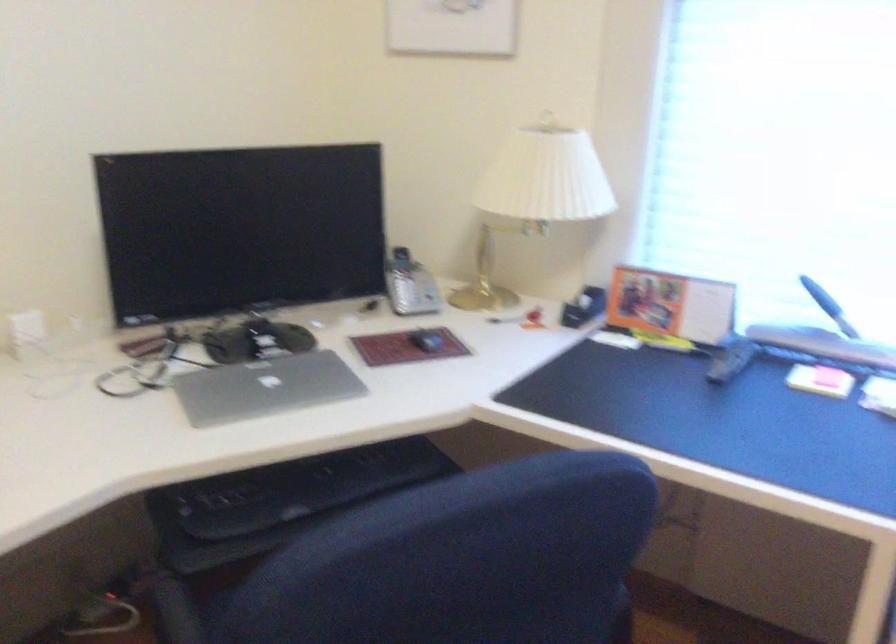
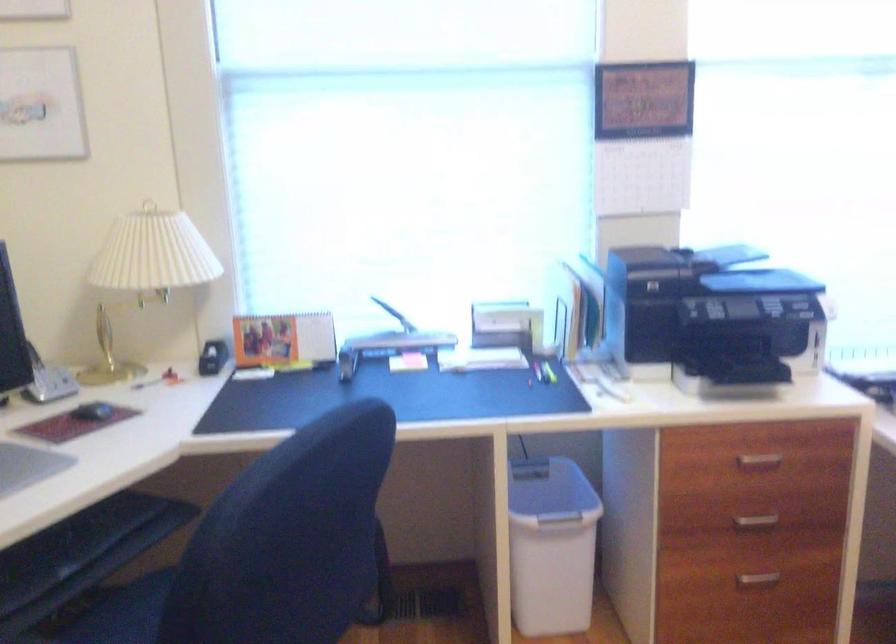
Question: The images are taken continuously from a first-person perspective. In which direction is your viewpoint rotating?

Choices:
 (A) Left
 (B) Right
 (C) Up
 (D) Down

Answer: (B)